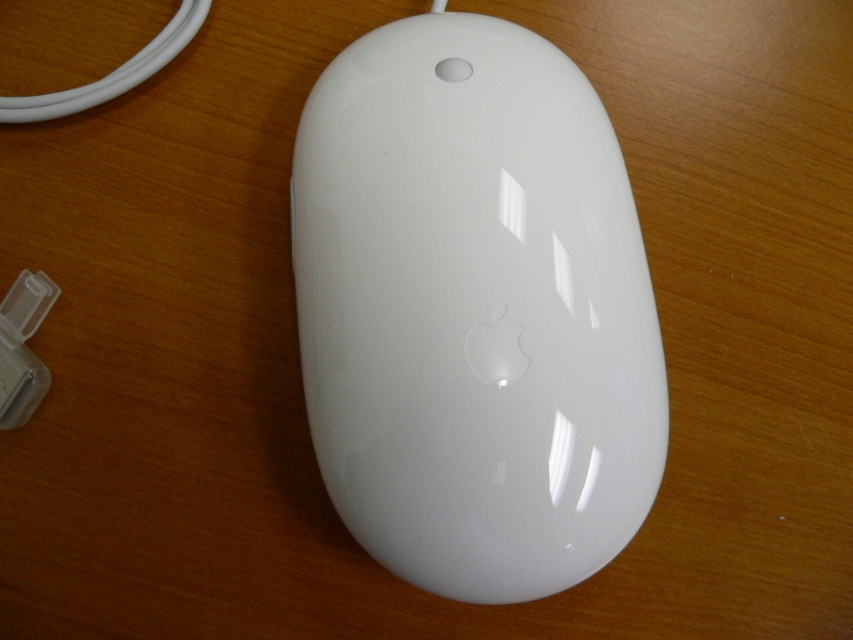
Question: Does white glossy mouse at center have a lesser width compared to clear plastic charger at lower left?

Choices:
 (A) no
 (B) yes

Answer: (A)

Question: Which point is closer to the camera?

Choices:
 (A) (45, 294)
 (B) (339, 412)

Answer: (B)

Question: Is white glossy mouse at center positioned in front of clear plastic charger at lower left?

Choices:
 (A) yes
 (B) no

Answer: (A)

Question: Which point is closer to the camera taking this photo?

Choices:
 (A) (332, 403)
 (B) (15, 316)

Answer: (B)

Question: Which point appears farthest from the camera in this image?

Choices:
 (A) pyautogui.click(x=350, y=481)
 (B) pyautogui.click(x=22, y=358)

Answer: (B)

Question: Is white glossy mouse at center to the left of clear plastic charger at lower left from the viewer's perspective?

Choices:
 (A) yes
 (B) no

Answer: (B)